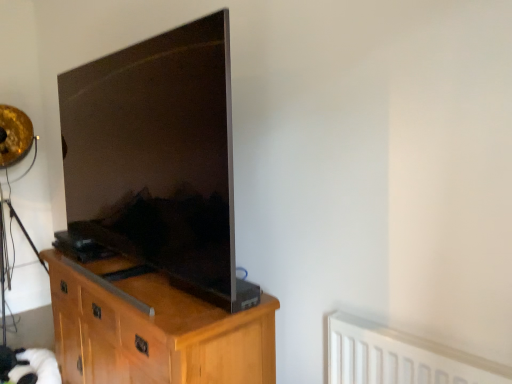
Question: Is light wood cabinet at center at the left side of white plastic radiator at lower right?

Choices:
 (A) no
 (B) yes

Answer: (B)

Question: From a real-world perspective, is light wood cabinet at center positioned over white plastic radiator at lower right based on gravity?

Choices:
 (A) yes
 (B) no

Answer: (B)

Question: Is there a large distance between light wood cabinet at center and white plastic radiator at lower right?

Choices:
 (A) no
 (B) yes

Answer: (A)

Question: Is light wood cabinet at center wider than white plastic radiator at lower right?

Choices:
 (A) yes
 (B) no

Answer: (A)

Question: Is light wood cabinet at center positioned with its back to white plastic radiator at lower right?

Choices:
 (A) yes
 (B) no

Answer: (B)

Question: Does point (140, 139) appear closer or farther from the camera than point (84, 294)?

Choices:
 (A) farther
 (B) closer

Answer: (B)

Question: Based on their sizes in the image, would you say matte black tv at left is bigger or smaller than light wood cabinet at center?

Choices:
 (A) big
 (B) small

Answer: (B)

Question: Is matte black tv at left inside the boundaries of light wood cabinet at center, or outside?

Choices:
 (A) inside
 (B) outside

Answer: (B)

Question: In the image, is matte black tv at left positioned in front of or behind light wood cabinet at center?

Choices:
 (A) front
 (B) behind

Answer: (A)

Question: Is light wood cabinet at center to the left or to the right of white plastic radiator at lower right in the image?

Choices:
 (A) left
 (B) right

Answer: (A)

Question: From a real-world perspective, is light wood cabinet at center above or below white plastic radiator at lower right?

Choices:
 (A) below
 (B) above

Answer: (A)

Question: Considering the positions of light wood cabinet at center and white plastic radiator at lower right in the image, is light wood cabinet at center bigger or smaller than white plastic radiator at lower right?

Choices:
 (A) small
 (B) big

Answer: (B)

Question: Is light wood cabinet at center spatially inside white plastic radiator at lower right, or outside of it?

Choices:
 (A) inside
 (B) outside

Answer: (B)

Question: From a real-world perspective, is white plastic radiator at lower right positioned above or below light wood cabinet at center?

Choices:
 (A) above
 (B) below

Answer: (A)

Question: Considering the positions of white plastic radiator at lower right and light wood cabinet at center in the image, is white plastic radiator at lower right wider or thinner than light wood cabinet at center?

Choices:
 (A) wide
 (B) thin

Answer: (B)